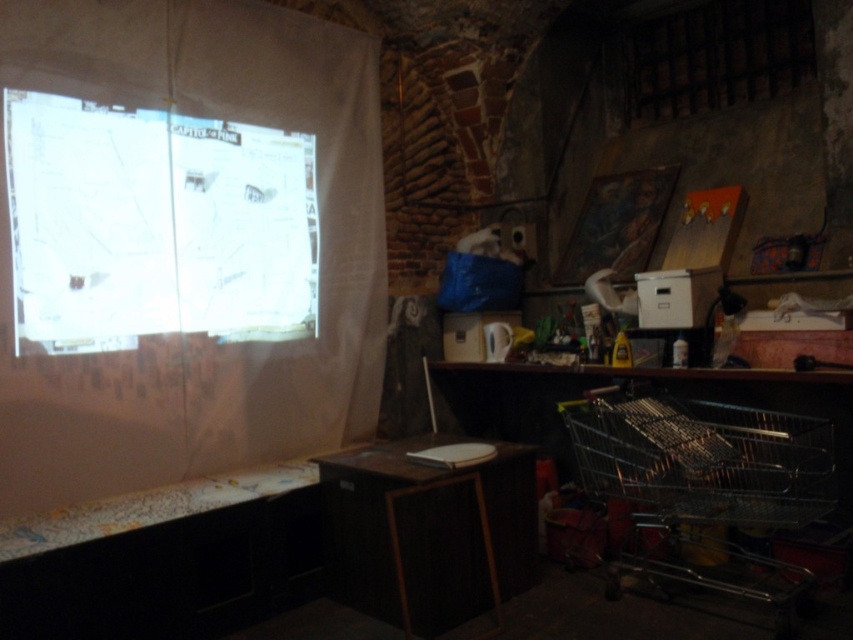
Looking at this image, you are in a room with a projection screen showing a map. You need to place a small box on the wooden table at center. However, there is a metallic wire shopping cart at lower right in the way. Can you move the box to the table without moving the shopping cart?

The metallic wire shopping cart at lower right is to the right of the wooden table at center, so there is space to the left of the shopping cart to move around it and place the box on the wooden table at center without moving the cart.